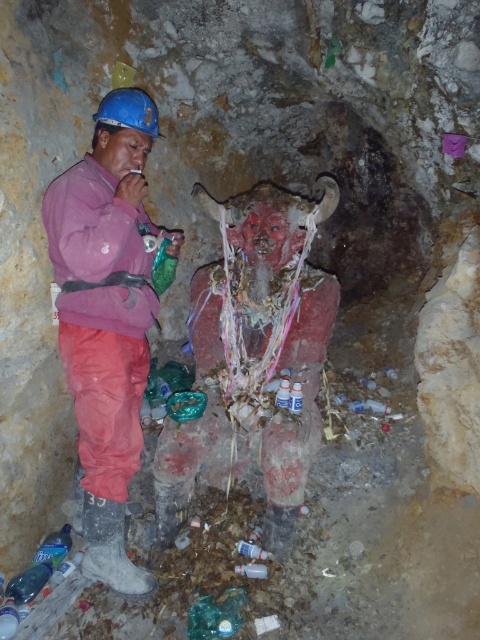
You are a safety inspector in the cave. You need to check the distance between the matte pink jacket at left and the matte red statue at center. Can you tell which one is nearer to you?

The matte pink jacket at left is closer to the viewer than the matte red statue at center, so the matte pink jacket at left is nearer to you.

You are a safety inspector in the cave. You need to check the height of the matte pink jacket at left and the matte red statue at center. Which one is higher?

The matte pink jacket at left is above the matte red statue at center, so it is higher.

You are standing in the cave scene. There is a point at coordinates [108,320]. What object is located at that point?

The point [108,320] corresponds to the matte pink jacket at left.